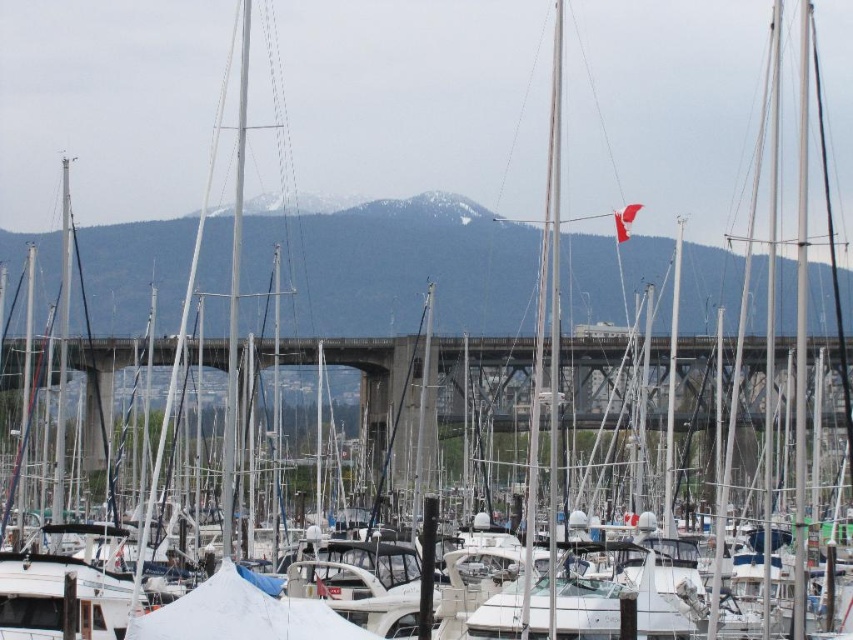
Does point (383, 330) come farther from viewer compared to point (70, 358)?

Yes.

The height and width of the screenshot is (640, 853). Find the location of `snowy mountain at upper center`. snowy mountain at upper center is located at coordinates (397, 268).